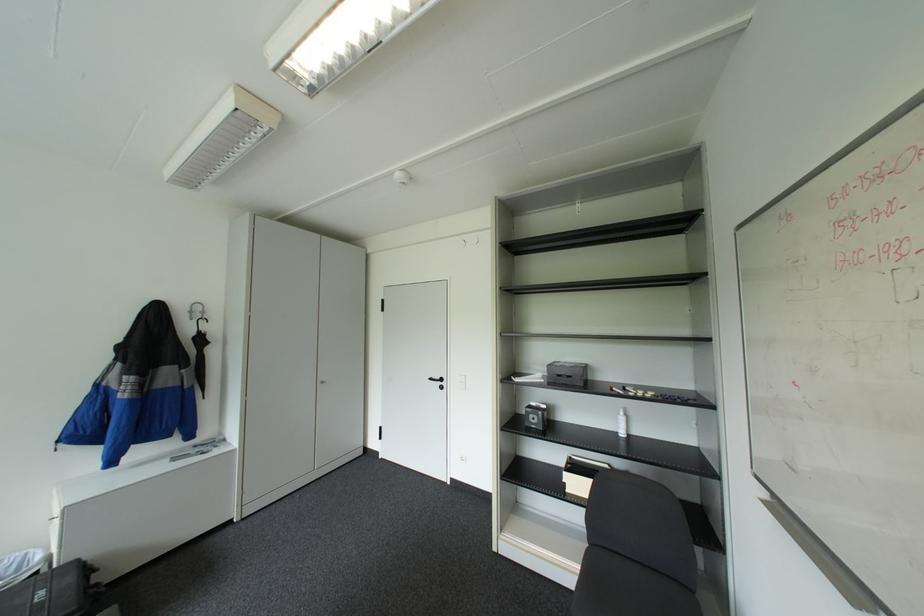
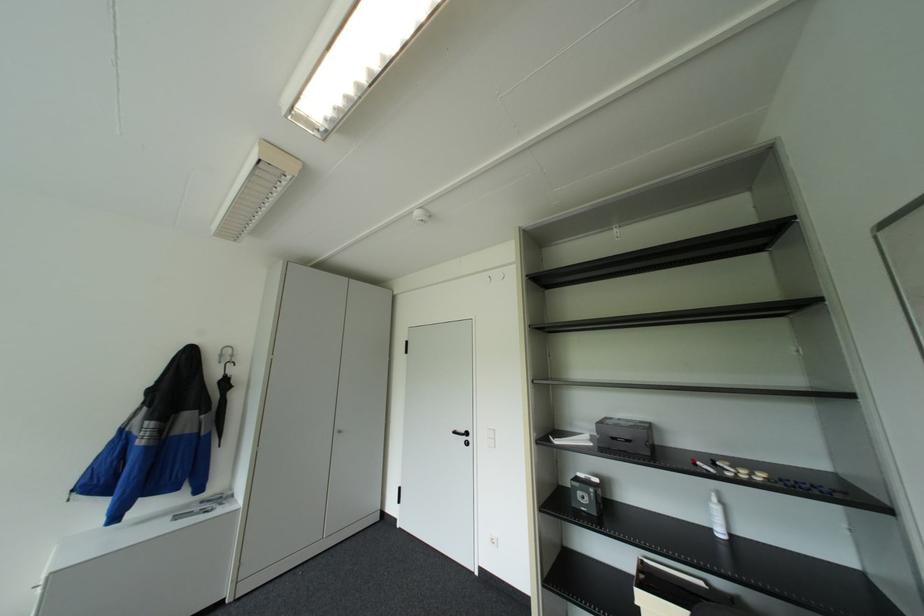
Where in the second image is the point corresponding to point 619,387 from the first image?

(702, 462)